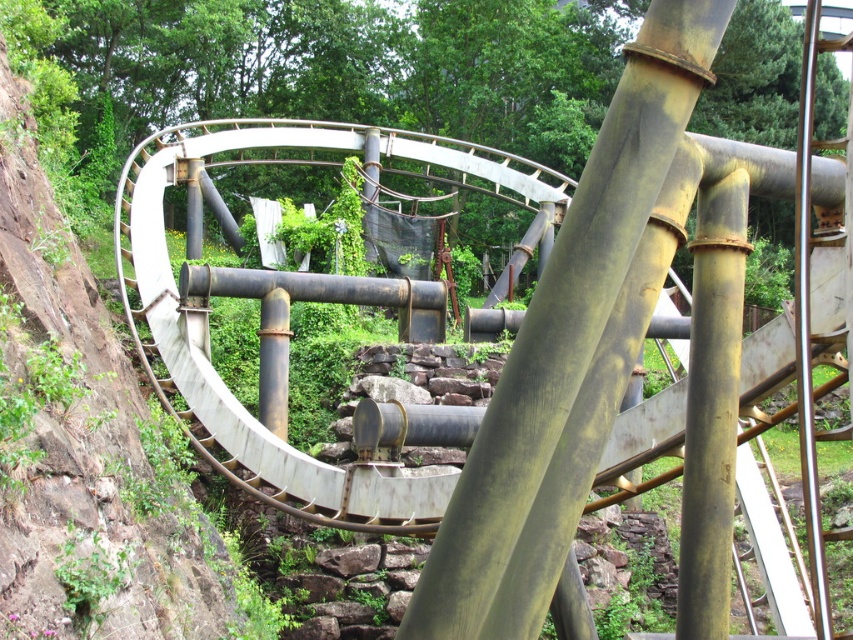
Does white matte roller coaster at upper left have a greater height compared to rusty metal pipe at center?

Indeed, white matte roller coaster at upper left has a greater height compared to rusty metal pipe at center.

Is point (10, 204) more distant than point (614, 264)?

Yes, point (10, 204) is farther from viewer.

Is point (172, 584) more distant than point (564, 349)?

Yes, it is.

What are the coordinates of `white matte roller coaster at upper left` in the screenshot? It's located at (88, 448).